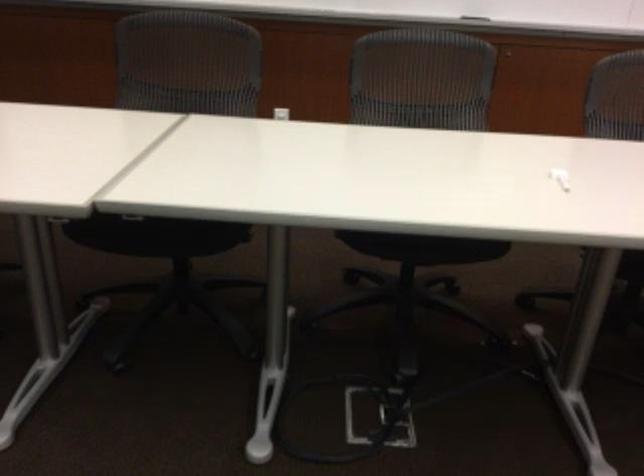
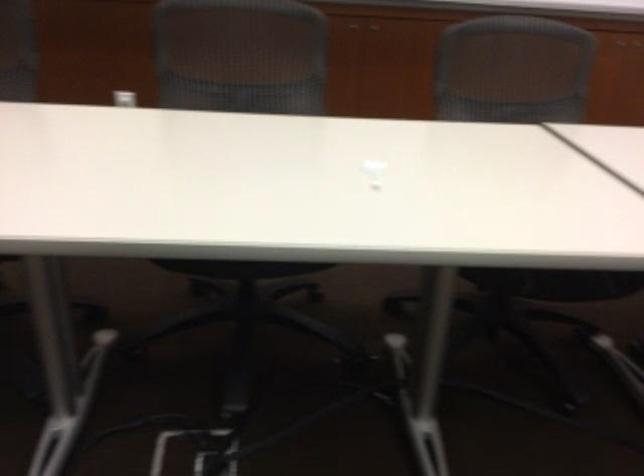
Find the pixel in the second image that matches point (281, 108) in the first image.

(125, 96)